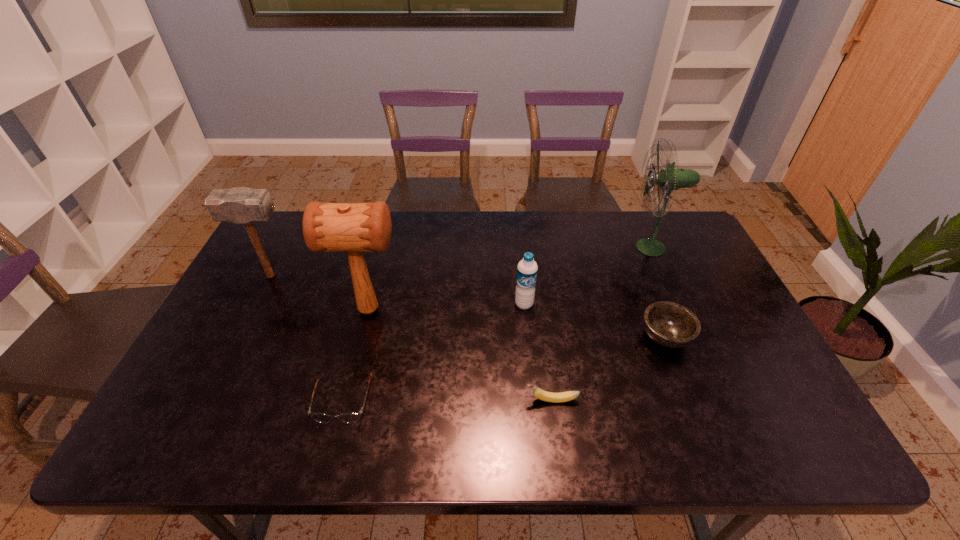
What are the coordinates of `object that is the second nearest to the fan` in the screenshot? It's located at (527, 268).

Find the location of a particular element. vacant position in the image that satisfies the following two spatial constraints: 1. on the striking face of the left mallet; 2. on the back side of the bowl is located at coordinates (240, 337).

This screenshot has height=540, width=960. Find the location of `free space that satisfies the following two spatial constraints: 1. on the front-facing side of the fan; 2. on the label of the fourth tallest object`. free space that satisfies the following two spatial constraints: 1. on the front-facing side of the fan; 2. on the label of the fourth tallest object is located at coordinates (677, 305).